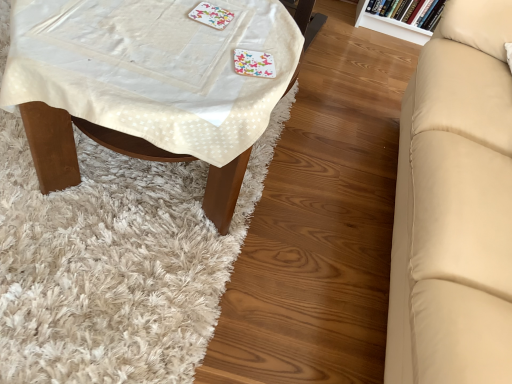
In order to face white textured mat at lower left, should I rotate leftwards or rightwards?

To face it directly, rotate left by 23.051 degrees.

Describe the element at coordinates (455, 206) in the screenshot. This screenshot has width=512, height=384. I see `beige leather couch at right` at that location.

You are a GUI agent. You are given a task and a screenshot of the screen. Output one action in this format:
    pyautogui.click(x=<x>, y=<y>)
    Task: Click on the white glossy bookshelf at upper right
    
    Given the screenshot: What is the action you would take?
    (x=409, y=11)

In order to click on colorful paper coaster at upper center in this screenshot , I will do `click(211, 15)`.

From their relative heights in the image, would you say beige leather couch at right is taller or shorter than white textured mat at lower left?

Clearly, beige leather couch at right is taller compared to white textured mat at lower left.

Is beige leather couch at right completely or partially outside of white textured mat at lower left?

Absolutely, beige leather couch at right is external to white textured mat at lower left.

In the image, there is a white textured mat at lower left. Where is `studio couch below it (from the image's perspective)`? This screenshot has height=384, width=512. studio couch below it (from the image's perspective) is located at coordinates (455, 206).

Is white textured mat at lower left far from white glossy bookshelf at upper right?

Yes, white textured mat at lower left and white glossy bookshelf at upper right are quite far apart.

Considering the sizes of objects white textured mat at lower left and white glossy bookshelf at upper right in the image provided, who is wider, white textured mat at lower left or white glossy bookshelf at upper right?

Wider between the two is white textured mat at lower left.

From a real-world perspective, which is physically above, white textured mat at lower left or white glossy bookshelf at upper right?

white glossy bookshelf at upper right, from a real-world perspective.

You are a GUI agent. You are given a task and a screenshot of the screen. Output one action in this format:
    pyautogui.click(x=<x>, y=<y>)
    Task: Click on the mat in front of the white glossy bookshelf at upper right
    This screenshot has width=512, height=384.
    Given the screenshot: What is the action you would take?
    pyautogui.click(x=114, y=263)

Based on the photo, from the image's perspective, relative to white textured mat at lower left, is colorful paper coaster at upper center above or below?

Based on their image positions, colorful paper coaster at upper center is located above white textured mat at lower left.

Choose the correct answer: Is colorful paper coaster at upper center inside white textured mat at lower left or outside it?

colorful paper coaster at upper center is not inside white textured mat at lower left, it's outside.

From a real-world perspective, between colorful paper coaster at upper center and white textured mat at lower left, who is vertically higher?

In real-world perspective, colorful paper coaster at upper center is above.

In the image, is colorful paper coaster at upper center on the left side or the right side of white textured mat at lower left?

Based on their positions, colorful paper coaster at upper center is located to the right of white textured mat at lower left.

From a real-world perspective, which is physically above, white textured mat at lower left or beige leather couch at right?

In real-world perspective, beige leather couch at right is above.

Is white textured mat at lower left turned away from beige leather couch at right?

white textured mat at lower left does not have its back to beige leather couch at right.

Which of these two, white textured mat at lower left or beige leather couch at right, is wider?

Wider between the two is white textured mat at lower left.

Who is taller, white textured mat at lower left or colorful paper coaster at upper center?

Standing taller between the two is white textured mat at lower left.

Is white textured mat at lower left looking in the opposite direction of colorful paper coaster at upper center?

No, white textured mat at lower left's orientation is not away from colorful paper coaster at upper center.

Is the position of white textured mat at lower left more distant than that of colorful paper coaster at upper center?

No, the depth of white textured mat at lower left is less than that of colorful paper coaster at upper center.

Which of these two, white glossy bookshelf at upper right or white fabric-covered table at left, is thinner?

With smaller width is white glossy bookshelf at upper right.

In the scene shown: Can you confirm if white glossy bookshelf at upper right is taller than white fabric-covered table at left?

In fact, white glossy bookshelf at upper right may be shorter than white fabric-covered table at left.

Is white glossy bookshelf at upper right oriented towards white fabric-covered table at left?

Yes, white glossy bookshelf at upper right is turned towards white fabric-covered table at left.

Is colorful paper coaster at upper center taller or shorter than beige leather couch at right?

Considering their sizes, colorful paper coaster at upper center has less height than beige leather couch at right.

What's the angular difference between colorful paper coaster at upper center and beige leather couch at right's facing directions?

90 degrees separate the facing orientations of colorful paper coaster at upper center and beige leather couch at right.

Is colorful paper coaster at upper center oriented towards beige leather couch at right?

No, colorful paper coaster at upper center is not facing towards beige leather couch at right.

Which of these two, colorful paper coaster at upper center or beige leather couch at right, is bigger?

beige leather couch at right is bigger.

The height and width of the screenshot is (384, 512). Find the location of `mat that is above the beige leather couch at right (from the image's perspective)`. mat that is above the beige leather couch at right (from the image's perspective) is located at coordinates (114, 263).

I want to click on book that is behind the white textured mat at lower left, so click(x=409, y=11).

When comparing their distances from white fabric-covered table at left, does beige leather couch at right or white glossy bookshelf at upper right seem closer?

beige leather couch at right is closer to white fabric-covered table at left.

Looking at the image, which one is located further to beige leather couch at right, white glossy bookshelf at upper right or white fabric-covered table at left?

Among the two, white glossy bookshelf at upper right is located further to beige leather couch at right.

Based on the photo, estimate the real-world distances between objects in this image. Which object is further from white fabric-covered table at left, colorful paper coaster at upper center or beige leather couch at right?

Based on the image, beige leather couch at right appears to be further to white fabric-covered table at left.

Estimate the real-world distances between objects in this image. Which object is further from white glossy bookshelf at upper right, white fabric-covered table at left or white textured mat at lower left?

Among the two, white fabric-covered table at left is located further to white glossy bookshelf at upper right.

Which object lies nearer to the anchor point white glossy bookshelf at upper right, white textured mat at lower left or colorful paper coaster at upper center?

The object closer to white glossy bookshelf at upper right is colorful paper coaster at upper center.

From the image, which object appears to be nearer to white glossy bookshelf at upper right, white textured mat at lower left or beige leather couch at right?

beige leather couch at right is closer to white glossy bookshelf at upper right.

Based on their spatial positions, is colorful paper coaster at upper center or beige leather couch at right further from white glossy bookshelf at upper right?

colorful paper coaster at upper center is positioned further to the anchor white glossy bookshelf at upper right.

Which object lies nearer to the anchor point beige leather couch at right, colorful paper coaster at upper center or white textured mat at lower left?

white textured mat at lower left is closer to beige leather couch at right.

What are the coordinates of `card game between beige leather couch at right and white glossy bookshelf at upper right along the z-axis` in the screenshot? It's located at (211, 15).

This screenshot has height=384, width=512. I want to click on card game between white textured mat at lower left and white glossy bookshelf at upper right from left to right, so click(x=211, y=15).

Locate an element on the screen. Image resolution: width=512 pixels, height=384 pixels. table between white textured mat at lower left and beige leather couch at right is located at coordinates (74, 145).

Identify the location of table between white textured mat at lower left and white glossy bookshelf at upper right. (74, 145).